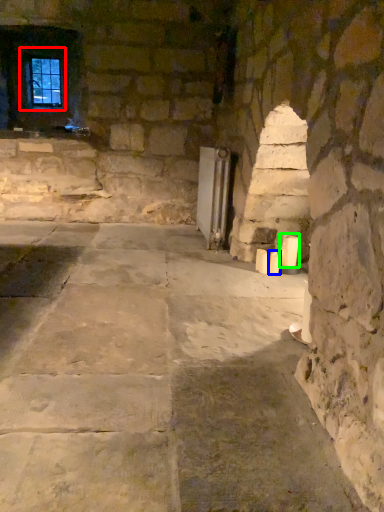
Question: Based on their relative distances, which object is farther from window (highlighted by a red box)? Choose from candle (highlighted by a blue box) and candle (highlighted by a green box).

Choices:
 (A) candle
 (B) candle

Answer: (A)